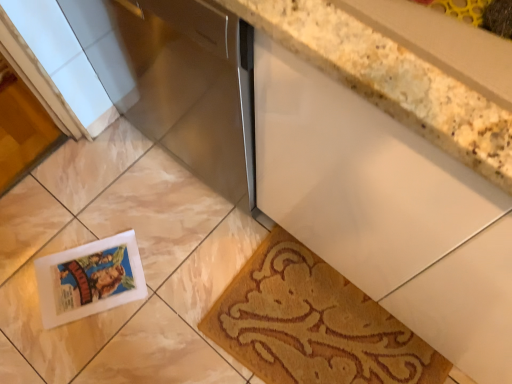
Question: Is white glossy postcard at lower left in contact with white granite countertop at upper right?

Choices:
 (A) yes
 (B) no

Answer: (B)

Question: Is white glossy postcard at lower left looking in the opposite direction of white granite countertop at upper right?

Choices:
 (A) no
 (B) yes

Answer: (A)

Question: Is white glossy postcard at lower left bigger than white granite countertop at upper right?

Choices:
 (A) yes
 (B) no

Answer: (B)

Question: Is white glossy postcard at lower left shorter than white granite countertop at upper right?

Choices:
 (A) no
 (B) yes

Answer: (B)

Question: Does white glossy postcard at lower left have a greater height compared to white granite countertop at upper right?

Choices:
 (A) yes
 (B) no

Answer: (B)

Question: From the image's perspective, relative to satin silver dishwasher at center, is white granite countertop at upper right above or below?

Choices:
 (A) below
 (B) above

Answer: (A)

Question: Would you say white granite countertop at upper right is to the left or to the right of satin silver dishwasher at center in the picture?

Choices:
 (A) right
 (B) left

Answer: (A)

Question: Based on their sizes in the image, would you say white granite countertop at upper right is bigger or smaller than satin silver dishwasher at center?

Choices:
 (A) big
 (B) small

Answer: (B)

Question: In terms of width, does white granite countertop at upper right look wider or thinner when compared to satin silver dishwasher at center?

Choices:
 (A) wide
 (B) thin

Answer: (B)

Question: In terms of height, does satin silver dishwasher at center look taller or shorter compared to brown textured mat at lower right?

Choices:
 (A) short
 (B) tall

Answer: (B)

Question: In terms of size, does satin silver dishwasher at center appear bigger or smaller than brown textured mat at lower right?

Choices:
 (A) small
 (B) big

Answer: (B)

Question: Looking at their shapes, would you say satin silver dishwasher at center is wider or thinner than brown textured mat at lower right?

Choices:
 (A) wide
 (B) thin

Answer: (A)

Question: Is point (227, 162) positioned closer to the camera than point (280, 317)?

Choices:
 (A) farther
 (B) closer

Answer: (B)

Question: Is white granite countertop at upper right taller or shorter than white glossy postcard at lower left?

Choices:
 (A) tall
 (B) short

Answer: (A)

Question: From the image's perspective, is white granite countertop at upper right positioned above or below white glossy postcard at lower left?

Choices:
 (A) below
 (B) above

Answer: (B)